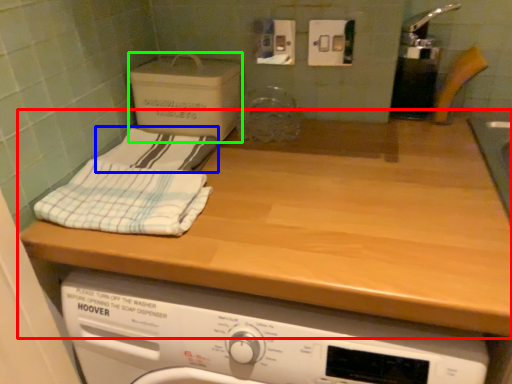
Question: Which is farther away from countertop (highlighted by a red box)? bath towel (highlighted by a blue box) or cardboard box (highlighted by a green box)?

Choices:
 (A) bath towel
 (B) cardboard box

Answer: (B)